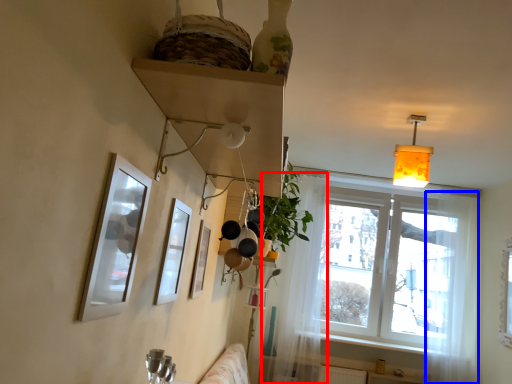
Question: Among these objects, which one is nearest to the camera, curtain (highlighted by a red box) or curtain (highlighted by a blue box)?

Choices:
 (A) curtain
 (B) curtain

Answer: (B)